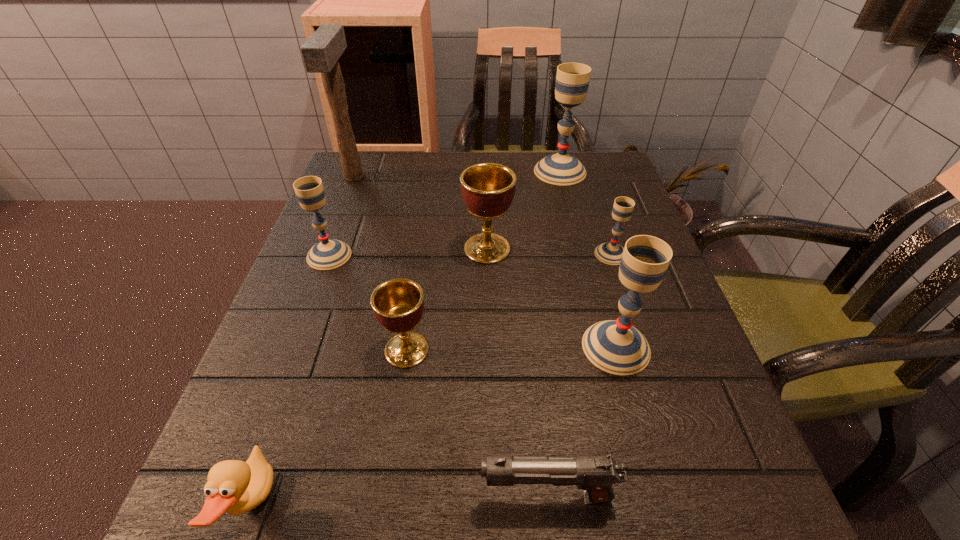
Where is `the tallest object`? This screenshot has width=960, height=540. the tallest object is located at coordinates (320, 53).

Where is `the farthest gray chalice`? The height and width of the screenshot is (540, 960). the farthest gray chalice is located at coordinates (572, 79).

You are a GUI agent. You are given a task and a screenshot of the screen. Output one action in this format:
    pyautogui.click(x=<x>, y=<y>)
    Task: Click on the tallest chalice
    This screenshot has width=960, height=540.
    Given the screenshot: What is the action you would take?
    pyautogui.click(x=572, y=79)

Locate an element on the screen. The image size is (960, 540). the second tallest chalice is located at coordinates (615, 346).

Identify the location of the nearest gray chalice. (615, 346).

What are the coordinates of `the leftmost chalice` in the screenshot? It's located at (327, 254).

Locate an element on the screen. The height and width of the screenshot is (540, 960). the leftmost gray chalice is located at coordinates (327, 254).

Locate an element on the screen. The height and width of the screenshot is (540, 960). the right golden chalice is located at coordinates (488, 189).

The width and height of the screenshot is (960, 540). Identify the location of the bigger golden chalice. (488, 189).

At what (x,y) coordinates should I click in order to perform the action: click on the sixth object from right to left. Please return your answer as a coordinate pair (x, y). The width and height of the screenshot is (960, 540). Looking at the image, I should click on (398, 304).